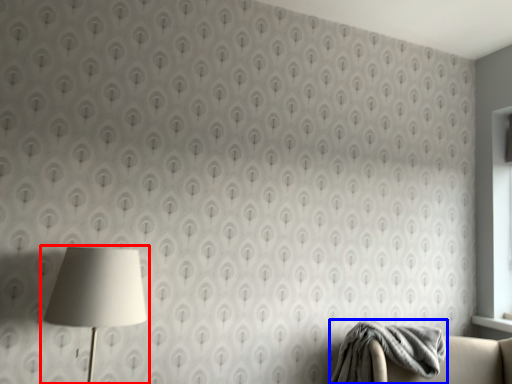
Question: Which point is further to the camera, lamp (highlighted by a red box) or blanket (highlighted by a blue box)?

Choices:
 (A) lamp
 (B) blanket

Answer: (B)